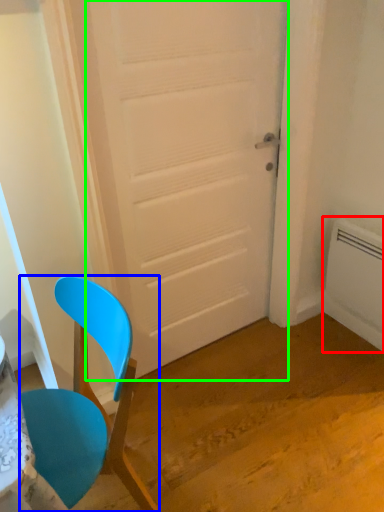
Question: Which object is the closest to the radiator (highlighted by a red box)? Choose among these: chair (highlighted by a blue box) or door (highlighted by a green box).

Choices:
 (A) chair
 (B) door

Answer: (B)